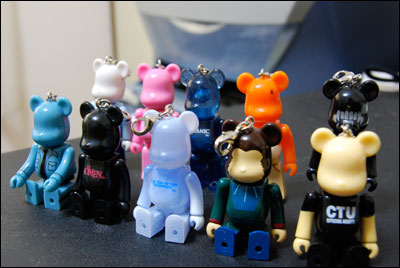
The height and width of the screenshot is (268, 400). Identify the location of white wall. (61, 37).